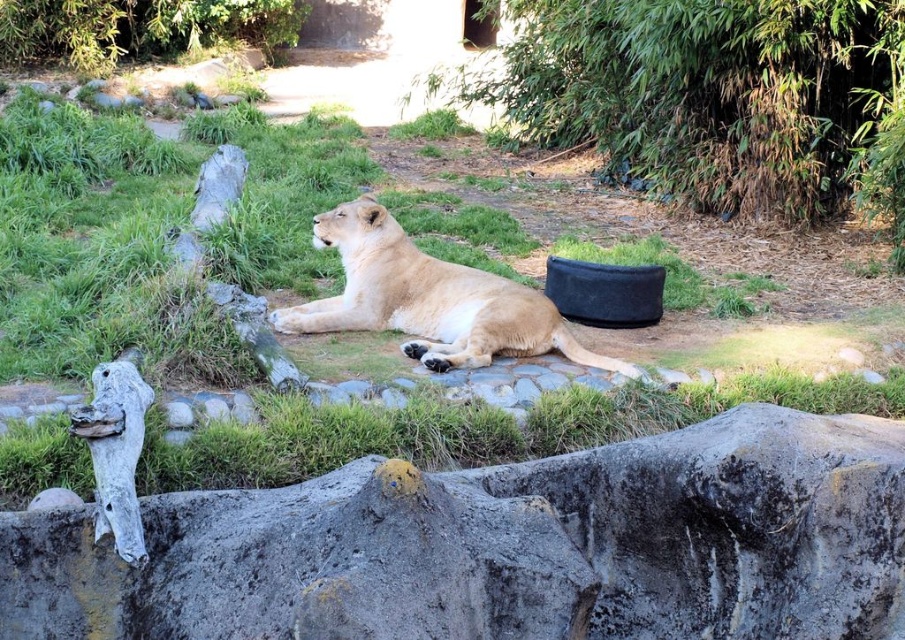
Is point (58, 186) closer to camera compared to point (565, 348)?

No, it is behind (565, 348).

Measure the distance between green grass at center and light brown fur at center.

green grass at center is 4.36 feet from light brown fur at center.

Which is in front, point (512, 243) or point (570, 355)?

Positioned in front is point (570, 355).

In order to click on green grass at center in this screenshot , I will do `click(150, 237)`.

Is the position of rough gray rock at lower center more distant than that of green grass at center?

No.

Which is below, rough gray rock at lower center or green grass at center?

rough gray rock at lower center

Does point (359, 500) come behind point (65, 118)?

No, it is not.

Find the location of a particular element. Image resolution: width=905 pixels, height=640 pixels. rough gray rock at lower center is located at coordinates pyautogui.click(x=506, y=547).

Can you confirm if rough gray rock at lower center is taller than light brown fur at center?

In fact, rough gray rock at lower center may be shorter than light brown fur at center.

What do you see at coordinates (506, 547) in the screenshot?
I see `rough gray rock at lower center` at bounding box center [506, 547].

Locate an element on the screen. rough gray rock at lower center is located at coordinates click(x=506, y=547).